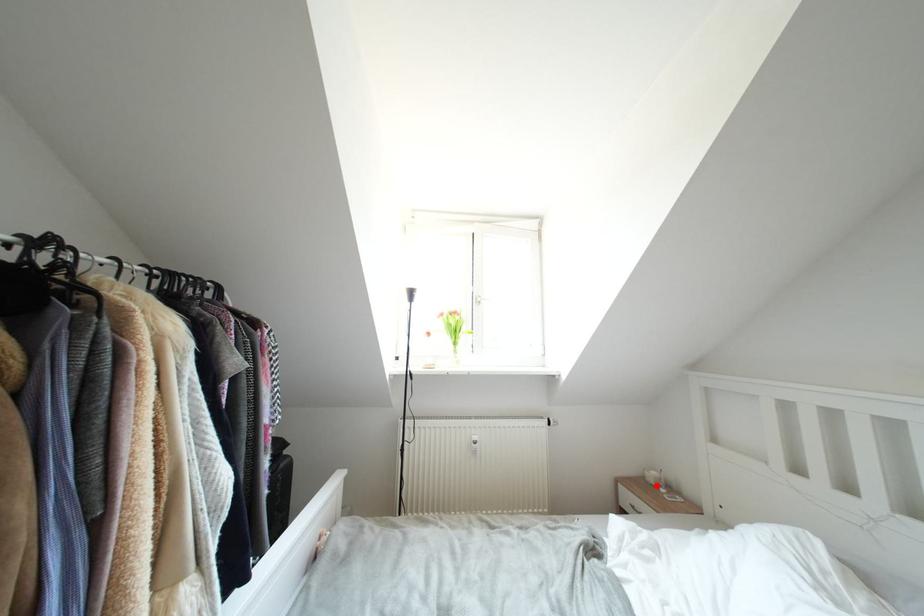
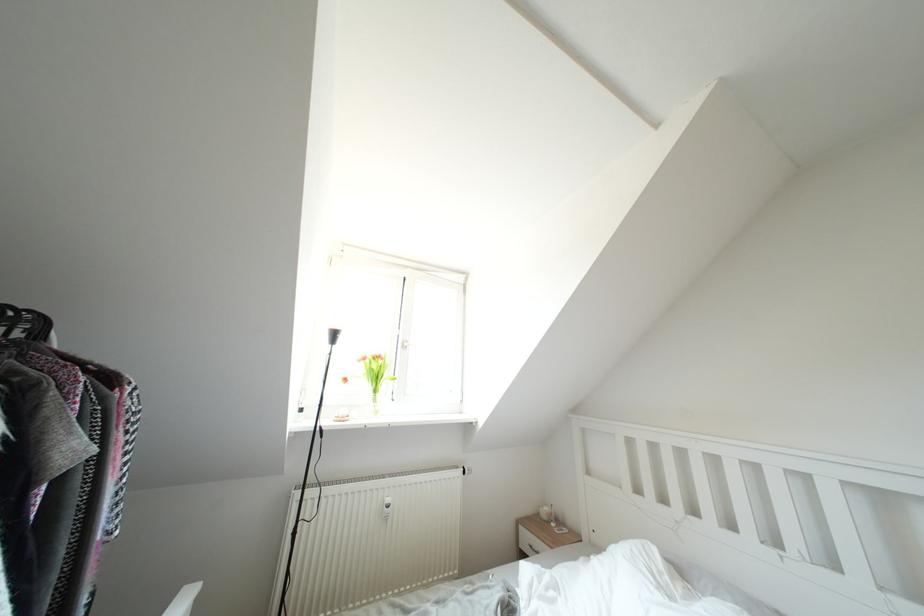
Question: I am providing you with two images of the same scene from different viewpoints. A red point is shown in image1. For the corresponding object point in image2, is it positioned nearer or farther from the camera?

Choices:
 (A) Nearer
 (B) Farther

Answer: (B)